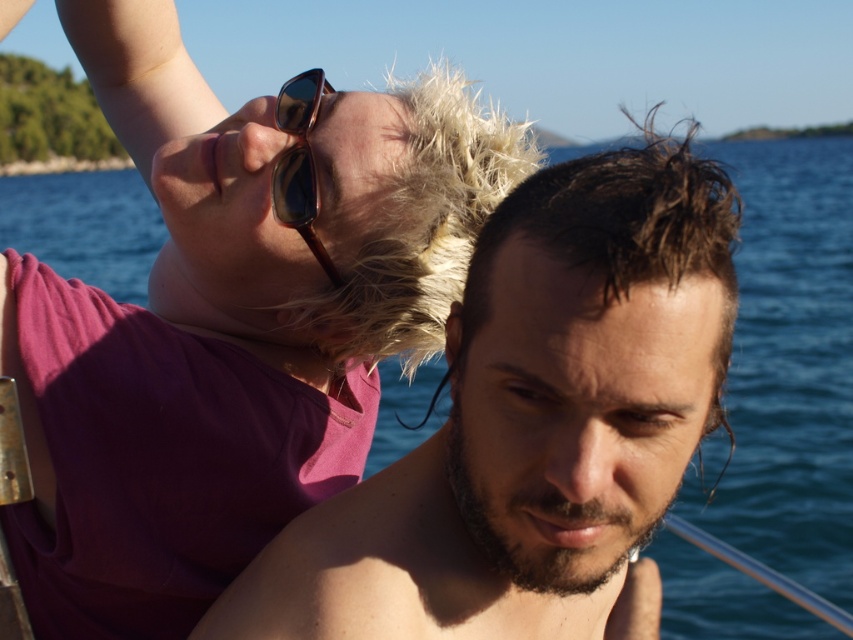
Does matte pink shirt at upper left have a greater height compared to shiny brown sunglasses at upper center?

Yes, matte pink shirt at upper left is taller than shiny brown sunglasses at upper center.

Measure the distance between matte pink shirt at upper left and shiny brown sunglasses at upper center.

matte pink shirt at upper left is 26.81 centimeters away from shiny brown sunglasses at upper center.

Is point (218, 458) positioned before point (311, 77)?

No, (218, 458) is behind (311, 77).

In order to click on matte pink shirt at upper left in this screenshot , I will do `click(231, 321)`.

Which of these two, shiny dark hair at center or shiny brown sunglasses at upper center, stands shorter?

With less height is shiny brown sunglasses at upper center.

Is shiny dark hair at center bigger than shiny brown sunglasses at upper center?

Yes.

Who is more forward, [316,604] or [323,268]?

Point [316,604] is in front.

Where is `shiny dark hair at center`? The height and width of the screenshot is (640, 853). shiny dark hair at center is located at coordinates (532, 420).

Looking at this image, between matte pink shirt at upper left and dark brown wet hair at center, which one appears on the left side from the viewer's perspective?

matte pink shirt at upper left

Between matte pink shirt at upper left and dark brown wet hair at center, which one is positioned higher?

dark brown wet hair at center is above.

Is point (433, 141) less distant than point (664, 200)?

No, (433, 141) is further to viewer.

Identify the location of matte pink shirt at upper left. (231, 321).